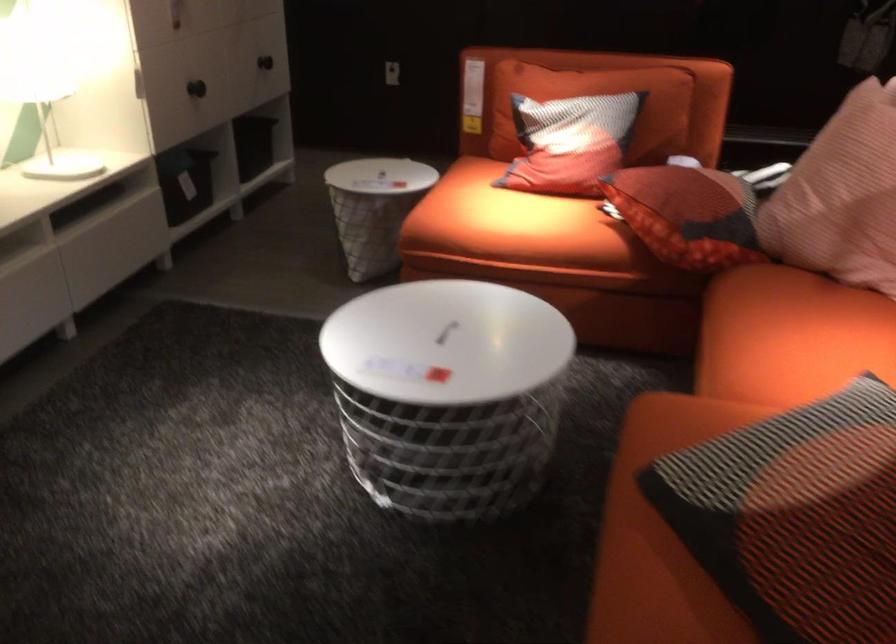
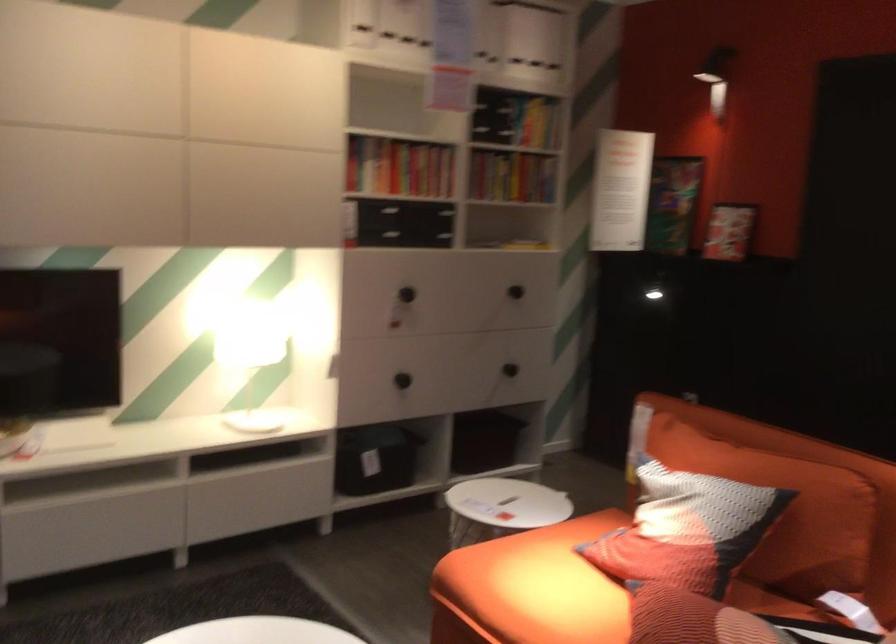
Where in the second image is the point corresponding to point 188,182 from the first image?

(375, 459)